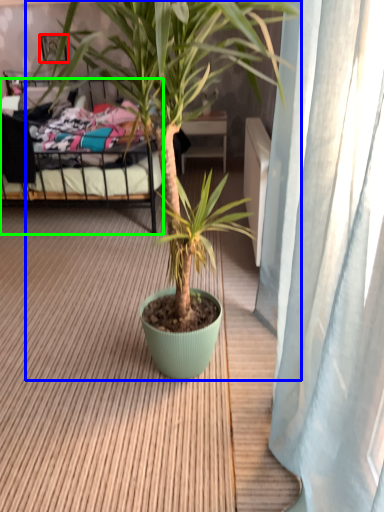
Question: Which is farther away from picture frame (highlighted by a red box)? houseplant (highlighted by a blue box) or bed (highlighted by a green box)?

Choices:
 (A) houseplant
 (B) bed

Answer: (A)